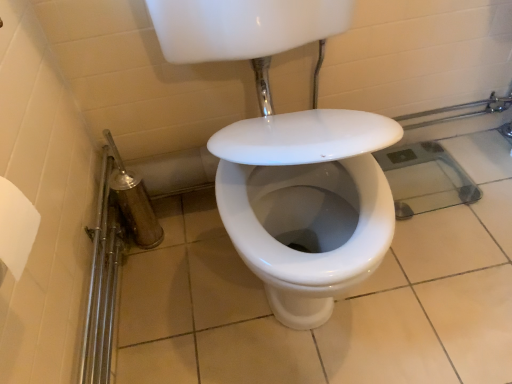
I want to click on free spot to the left of white glossy sink at center, so click(169, 296).